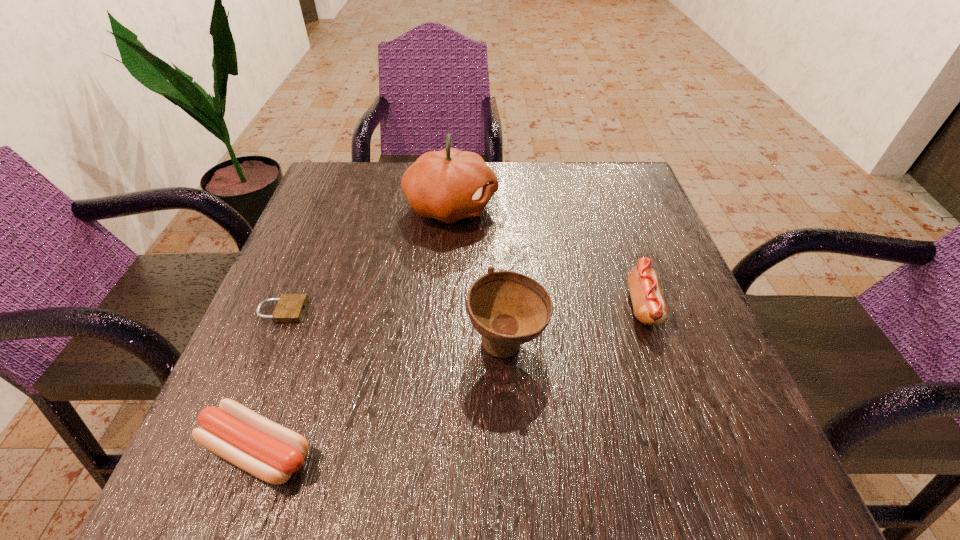
Where is `the farthest object`? The width and height of the screenshot is (960, 540). the farthest object is located at coordinates (449, 185).

I want to click on pumpkin, so click(449, 185).

Locate an element on the screen. This screenshot has height=540, width=960. the fourth shortest object is located at coordinates (508, 309).

This screenshot has height=540, width=960. What are the coordinates of `the right sausage` in the screenshot? It's located at (649, 306).

The width and height of the screenshot is (960, 540). Identify the location of the farther sausage. (649, 306).

The height and width of the screenshot is (540, 960). What are the coordinates of `the left sausage` in the screenshot? It's located at (259, 446).

Where is `the nearer sausage`? The height and width of the screenshot is (540, 960). the nearer sausage is located at coordinates (259, 446).

At what (x,y) coordinates should I click in order to perform the action: click on padlock. Please return your answer as a coordinate pair (x, y). The height and width of the screenshot is (540, 960). Looking at the image, I should click on (290, 308).

The width and height of the screenshot is (960, 540). Identify the location of blank space located on the front face of the farthest object. (570, 207).

You are a GUI agent. You are given a task and a screenshot of the screen. Output one action in this format:
    pyautogui.click(x=<x>, y=<y>)
    Task: Click on the free space located 0.160m on the front of the second tallest object
    The height and width of the screenshot is (540, 960).
    Given the screenshot: What is the action you would take?
    pos(515,481)